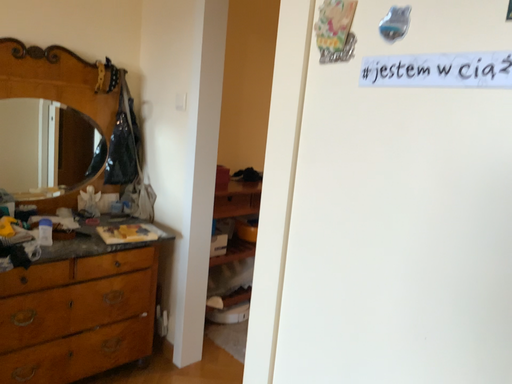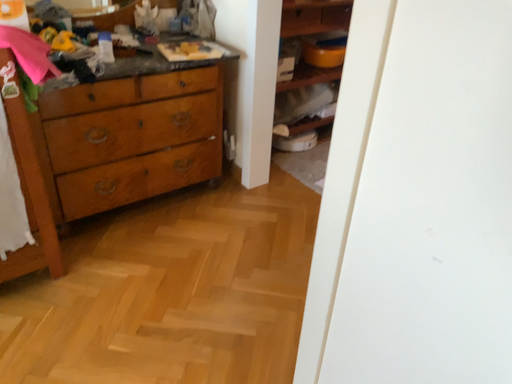
Question: Which way did the camera rotate in the video?

Choices:
 (A) rotated downward
 (B) rotated upward

Answer: (A)